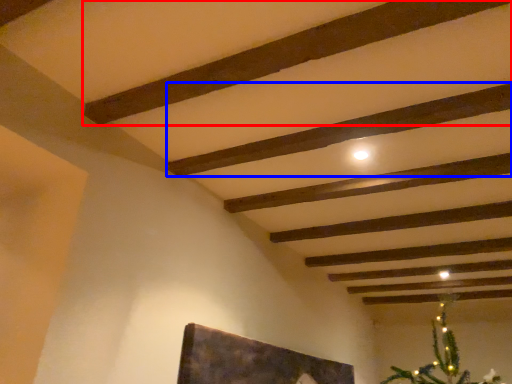
Question: Among these objects, which one is farthest to the camera, plank (highlighted by a red box) or plank (highlighted by a blue box)?

Choices:
 (A) plank
 (B) plank

Answer: (B)